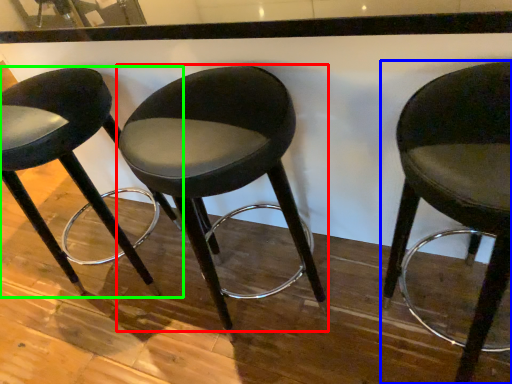
Question: Which object is the closest to the chair (highlighted by a red box)? Choose among these: chair (highlighted by a blue box) or chair (highlighted by a green box).

Choices:
 (A) chair
 (B) chair

Answer: (A)